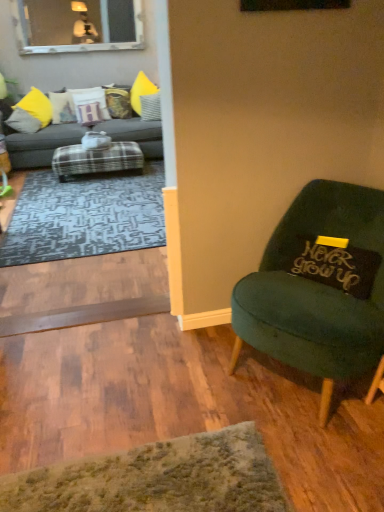
Question: Which direction should I rotate to look at white fabric pillow at upper center, which is the third pillow from front to back?

Choices:
 (A) left
 (B) right

Answer: (A)

Question: From the image's perspective, is white fabric pillow at upper center, placed as the third pillow when sorted from bottom to top, beneath velvet yellow pillow at center, which is counted as the 6th pillow, starting from the bottom?

Choices:
 (A) no
 (B) yes

Answer: (B)

Question: Could you tell me if white fabric pillow at upper center, placed as the third pillow when sorted from bottom to top, is turned towards velvet yellow pillow at center, the 3th pillow from the right?

Choices:
 (A) yes
 (B) no

Answer: (B)

Question: Is white fabric pillow at upper center, which is the third pillow from front to back, oriented away from velvet yellow pillow at center, which is counted as the 6th pillow, starting from the bottom?

Choices:
 (A) yes
 (B) no

Answer: (B)

Question: Can you confirm if white fabric pillow at upper center, the fifth pillow positioned from the left, is positioned to the right of velvet yellow pillow at center, marked as the 6th pillow in a front-to-back arrangement?

Choices:
 (A) yes
 (B) no

Answer: (A)

Question: From a real-world perspective, does white fabric pillow at upper center, the 2th pillow from the right, sit lower than velvet yellow pillow at center, the first pillow from the top?

Choices:
 (A) yes
 (B) no

Answer: (A)

Question: Is velvet yellow pillow at center, the first pillow from the top, completely or partially inside white fabric pillow at upper center, the 2th pillow from the right?

Choices:
 (A) yes
 (B) no

Answer: (B)

Question: Is white fabric pillow at upper center, which is the third pillow from front to back, not near velvet green chair at right?

Choices:
 (A) no
 (B) yes

Answer: (B)

Question: From the image's perspective, would you say white fabric pillow at upper center, the fourth pillow from the back, is positioned over velvet green chair at right?

Choices:
 (A) no
 (B) yes

Answer: (B)

Question: Considering the relative sizes of white fabric pillow at upper center, which is the third pillow from front to back, and velvet green chair at right in the image provided, is white fabric pillow at upper center, which is the third pillow from front to back, smaller than velvet green chair at right?

Choices:
 (A) no
 (B) yes

Answer: (B)

Question: Is white fabric pillow at upper center, the fifth pillow positioned from the left, shorter than velvet green chair at right?

Choices:
 (A) yes
 (B) no

Answer: (A)

Question: From the image's perspective, would you say white fabric pillow at upper center, which is the fourth pillow in top-to-bottom order, is shown under velvet green chair at right?

Choices:
 (A) yes
 (B) no

Answer: (B)

Question: Is white fabric pillow at upper center, which is the third pillow from front to back, positioned before velvet green chair at right?

Choices:
 (A) no
 (B) yes

Answer: (A)

Question: Is clear glass window at upper left thinner than velvet green chair at right?

Choices:
 (A) yes
 (B) no

Answer: (A)